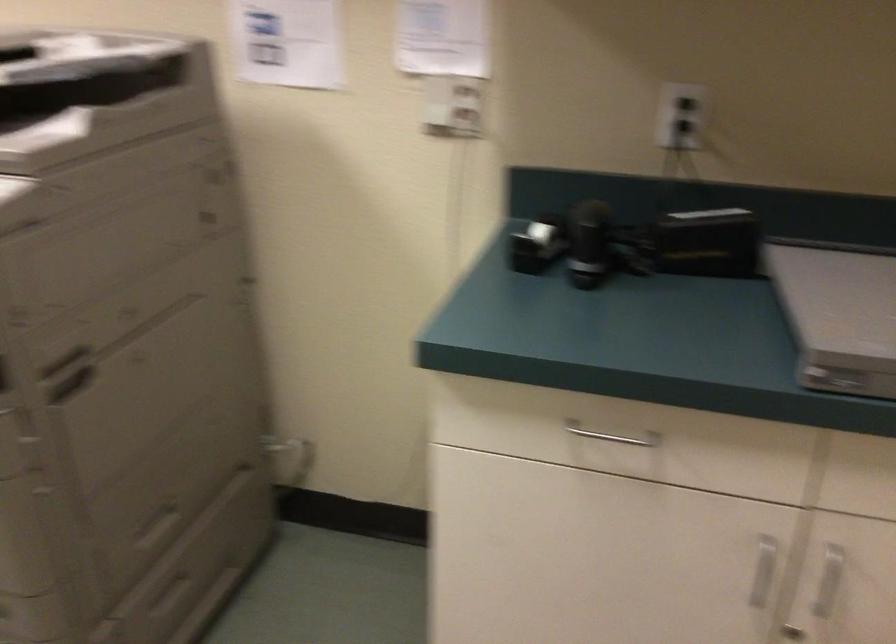
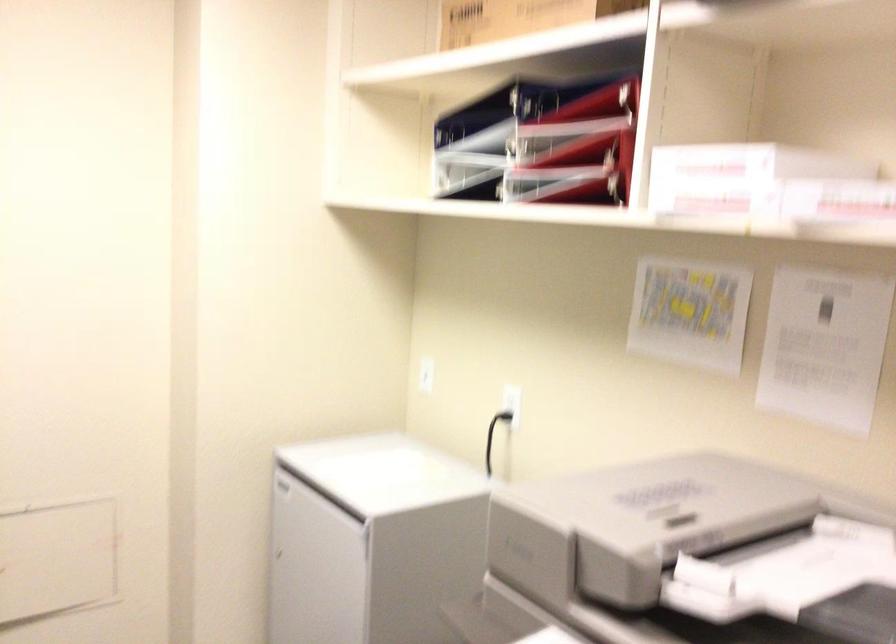
Question: The camera is either moving clockwise (left) or counter-clockwise (right) around the object. The first image is from the beginning of the video and the second image is from the end. Is the camera moving left or right when shooting the video?

Choices:
 (A) Left
 (B) Right

Answer: (B)